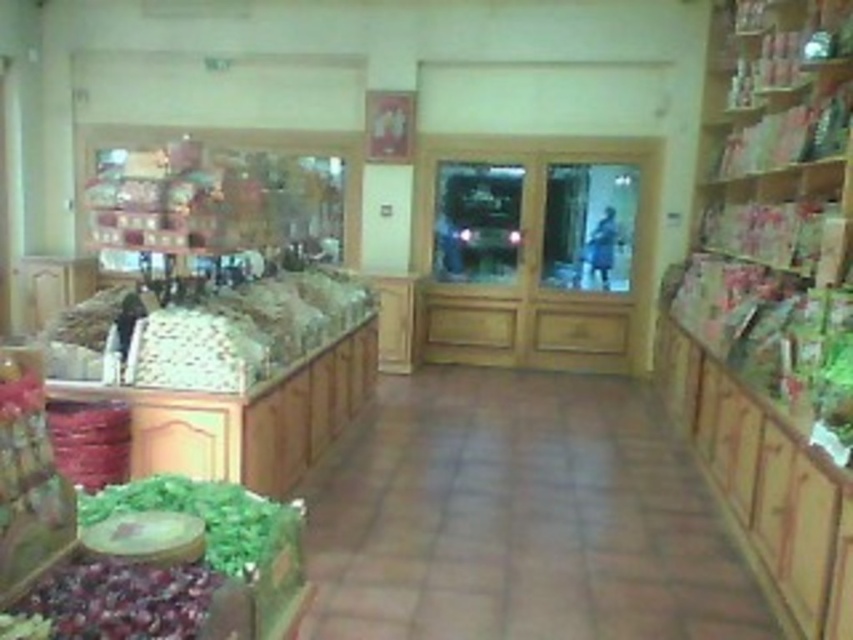
Which of these two, green leafy vegetables at lower left or green textured herbs at center, stands shorter?

Standing shorter between the two is green leafy vegetables at lower left.

Does green leafy vegetables at lower left appear under green textured herbs at center?

Yes.

Who is more forward, (x=57, y=602) or (x=285, y=288)?

Point (x=57, y=602) is in front.

The image size is (853, 640). I want to click on green leafy vegetables at lower left, so click(177, 580).

Does green leafy vegetables at lower left have a greater height compared to shiny purple grapes at lower left?

Indeed, green leafy vegetables at lower left has a greater height compared to shiny purple grapes at lower left.

Is green leafy vegetables at lower left positioned at the back of shiny purple grapes at lower left?

No, it is in front of shiny purple grapes at lower left.

Which is in front, point (225, 621) or point (108, 595)?

Point (108, 595)

The width and height of the screenshot is (853, 640). Identify the location of green leafy vegetables at lower left. (177, 580).

The height and width of the screenshot is (640, 853). What do you see at coordinates (247, 330) in the screenshot?
I see `green textured herbs at center` at bounding box center [247, 330].

Who is more forward, (x=329, y=321) or (x=62, y=625)?

Positioned in front is point (x=62, y=625).

Identify the location of green textured herbs at center. Image resolution: width=853 pixels, height=640 pixels. click(x=247, y=330).